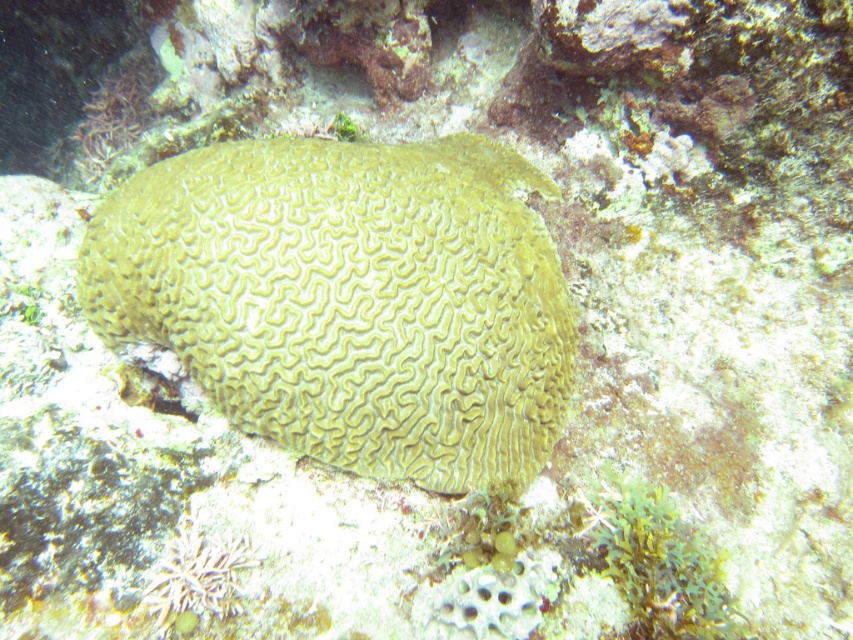
Question: Does yellow brain coral at center come in front of green matte algae at lower right?

Choices:
 (A) no
 (B) yes

Answer: (A)

Question: Which object is closer to the camera taking this photo?

Choices:
 (A) yellow brain coral at center
 (B) green matte algae at lower right

Answer: (B)

Question: Can you confirm if yellow brain coral at center is smaller than green matte algae at lower right?

Choices:
 (A) no
 (B) yes

Answer: (A)

Question: From the image, what is the correct spatial relationship of yellow brain coral at center in relation to green matte algae at lower right?

Choices:
 (A) below
 (B) above

Answer: (B)